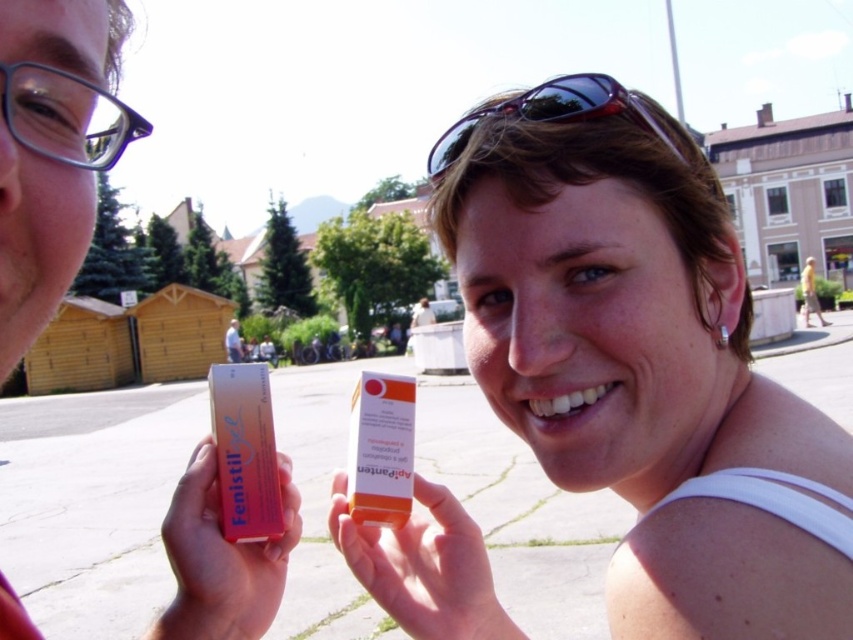
You are a delivery person who needs to place a new orange plastic tube at center in the exact same location as the existing one. What coordinates should you use?

The orange plastic tube at center should be placed at coordinates point (424, 566).

You are standing at the point with coordinates point (10, 97) and want to walk to the point with coordinates point (439, 150). Which direction should you walk to reach your destination?

To reach point (439, 150) from point (10, 97), you should walk towards the upper right direction since point (439, 150) is behind point (10, 97).

You are a photographer trying to capture a closeup of the clear plastic glasses at upper left and the shiny purple sunglasses at upper center. Which object should you focus on first to ensure both are in focus?

You should focus on the clear plastic glasses at upper left first because it is closer to the viewer than the shiny purple sunglasses at upper center, so adjusting focus from near to far will help both be in focus.